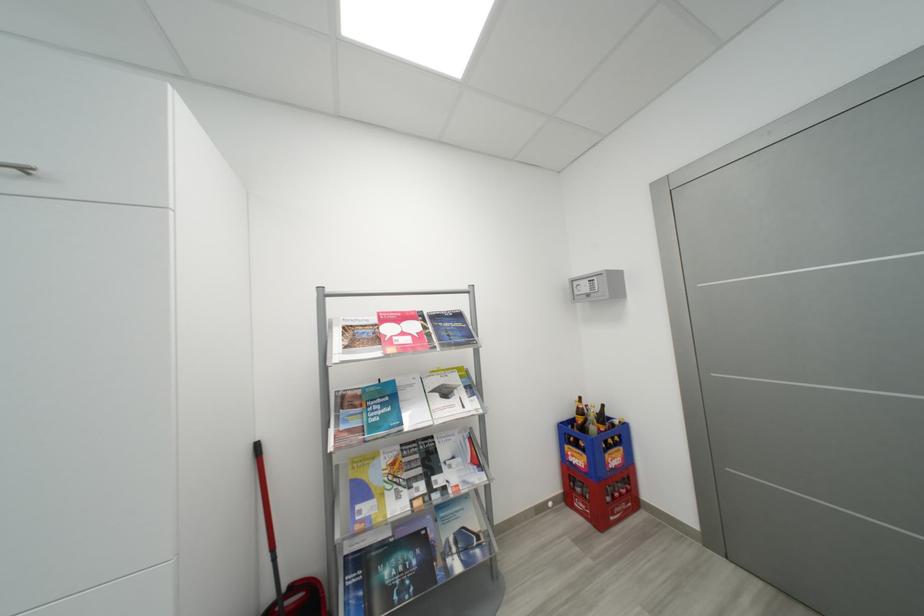
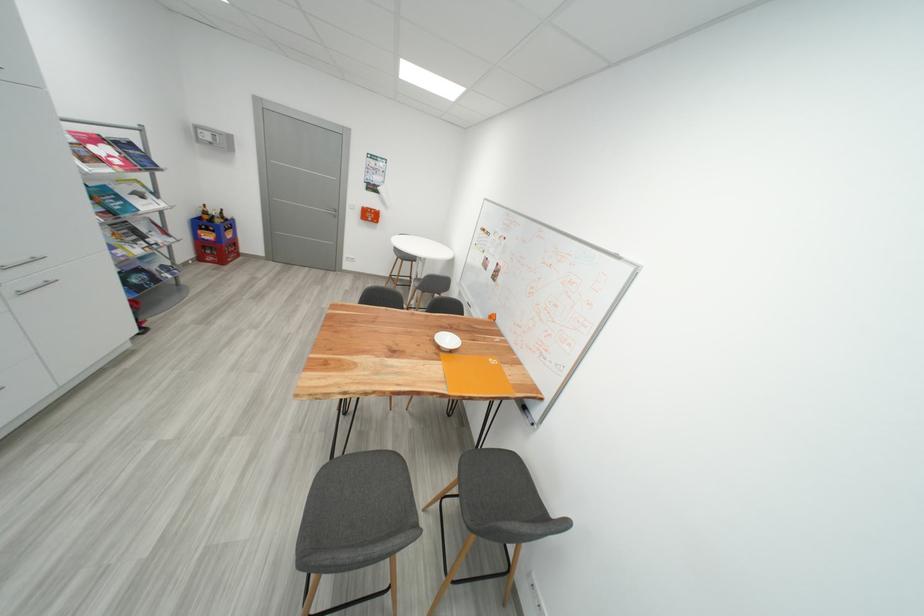
The point at (x=391, y=407) is marked in the first image. Where is the corresponding point in the second image?

(122, 201)